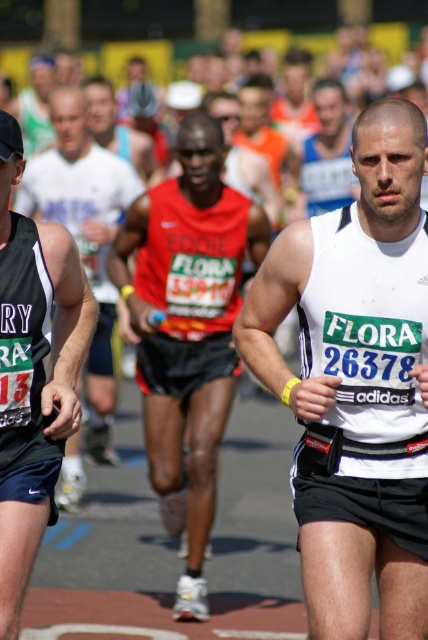
Question: Which object is closer to the camera taking this photo?

Choices:
 (A) red fabric shirt at center
 (B) white matte singlet at center

Answer: (B)

Question: Which is nearer to the white matte singlet at center?

Choices:
 (A) red mesh tank top at center
 (B) red fabric shirt at center

Answer: (B)

Question: Can you confirm if red fabric shirt at center is thinner than red mesh tank top at center?

Choices:
 (A) yes
 (B) no

Answer: (A)

Question: Which of these objects is positioned closest to the white matte singlet at center?

Choices:
 (A) red mesh tank top at center
 (B) red fabric shirt at center

Answer: (B)

Question: Does red fabric shirt at center have a larger size compared to red mesh tank top at center?

Choices:
 (A) no
 (B) yes

Answer: (A)

Question: Is the position of white matte singlet at center more distant than that of red fabric shirt at center?

Choices:
 (A) yes
 (B) no

Answer: (B)